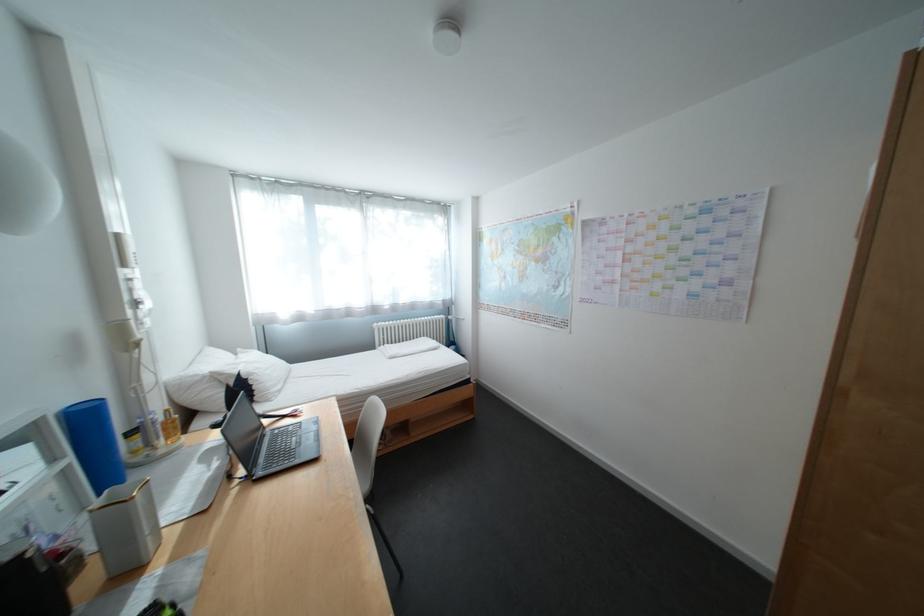
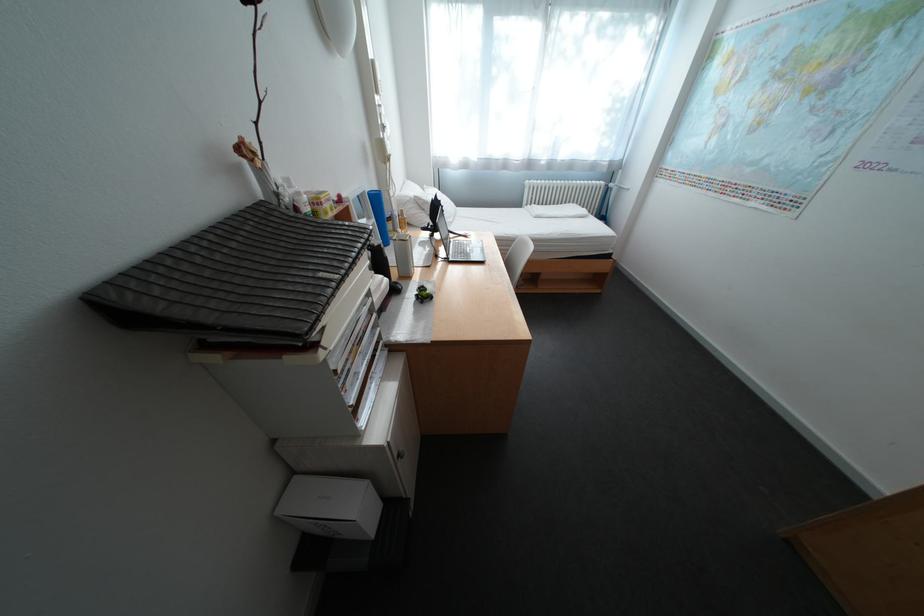
Find the pixel in the second image that matches [211,379] in the first image.

(420, 200)